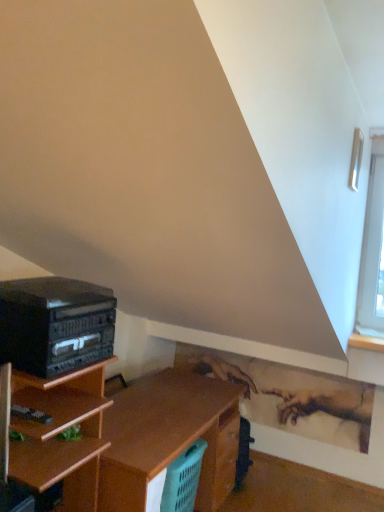
Question: Is clear glass window at upper right surrounding black matte stereo at left?

Choices:
 (A) yes
 (B) no

Answer: (B)

Question: Is clear glass window at upper right smaller than black matte stereo at left?

Choices:
 (A) yes
 (B) no

Answer: (A)

Question: Can you confirm if clear glass window at upper right is wider than black matte stereo at left?

Choices:
 (A) yes
 (B) no

Answer: (B)

Question: Is clear glass window at upper right positioned with its back to black matte stereo at left?

Choices:
 (A) no
 (B) yes

Answer: (A)

Question: From the image's perspective, would you say clear glass window at upper right is shown under black matte stereo at left?

Choices:
 (A) no
 (B) yes

Answer: (A)

Question: From the image's perspective, relative to black matte stereo at left, is teal plastic laundry basket at lower center above or below?

Choices:
 (A) above
 (B) below

Answer: (B)

Question: Is teal plastic laundry basket at lower center bigger or smaller than black matte stereo at left?

Choices:
 (A) small
 (B) big

Answer: (B)

Question: Considering the relative positions of teal plastic laundry basket at lower center and black matte stereo at left in the image provided, is teal plastic laundry basket at lower center to the left or to the right of black matte stereo at left?

Choices:
 (A) right
 (B) left

Answer: (A)

Question: Is teal plastic laundry basket at lower center inside or outside of black matte stereo at left?

Choices:
 (A) inside
 (B) outside

Answer: (B)

Question: Is black matte stereo at left wider or thinner than teal plastic laundry basket at lower center?

Choices:
 (A) wide
 (B) thin

Answer: (A)

Question: Is black matte stereo at left inside the boundaries of teal plastic laundry basket at lower center, or outside?

Choices:
 (A) inside
 (B) outside

Answer: (B)

Question: Considering the positions of point (84, 342) and point (175, 472), is point (84, 342) closer or farther from the camera than point (175, 472)?

Choices:
 (A) closer
 (B) farther

Answer: (A)

Question: From a real-world perspective, is black matte stereo at left physically located above or below teal plastic laundry basket at lower center?

Choices:
 (A) above
 (B) below

Answer: (A)

Question: From the image's perspective, is black matte stereo at left positioned above or below clear glass window at upper right?

Choices:
 (A) below
 (B) above

Answer: (A)

Question: In terms of height, does black matte stereo at left look taller or shorter compared to clear glass window at upper right?

Choices:
 (A) tall
 (B) short

Answer: (A)